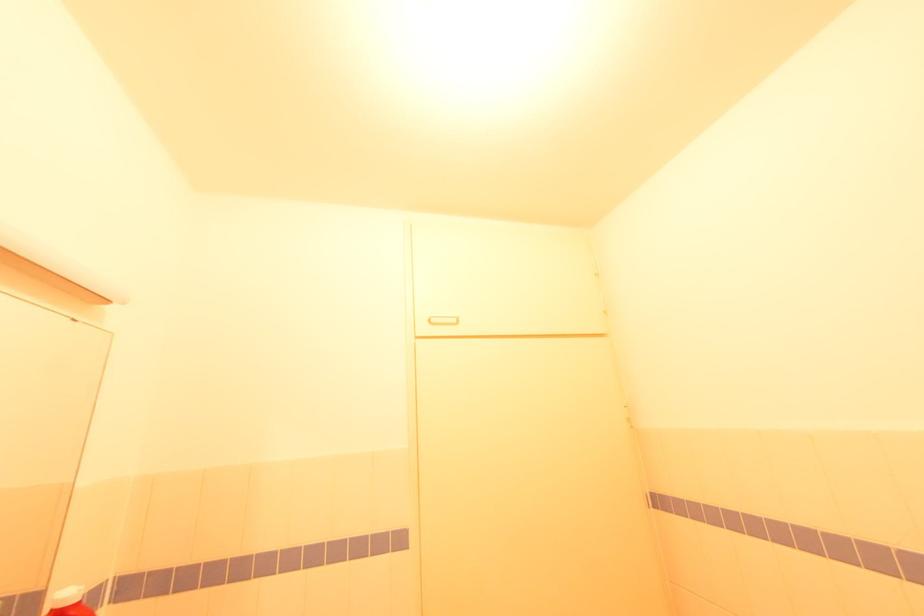
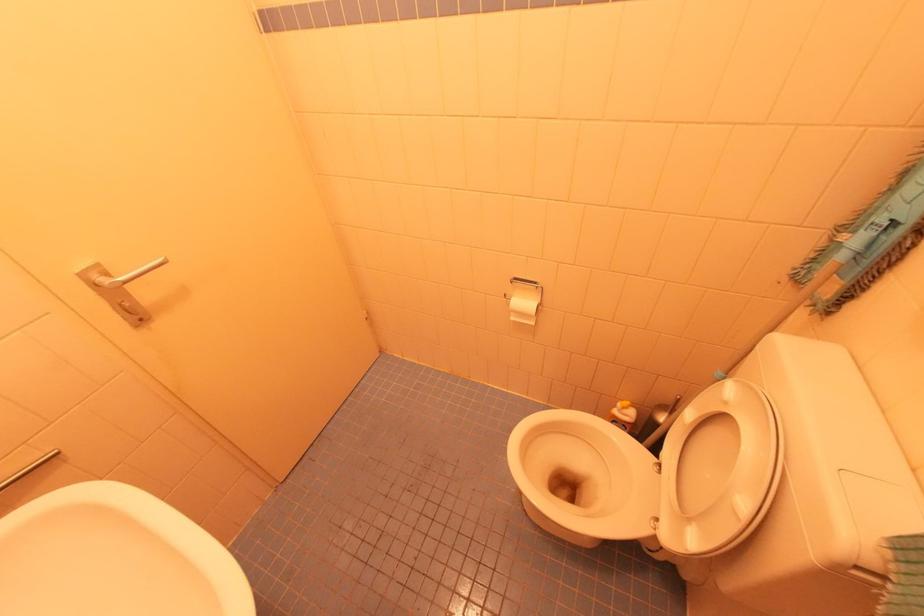
The first image is from the beginning of the video and the second image is from the end. How did the camera likely rotate when shooting the video?

The rotation direction of the camera is right-down.